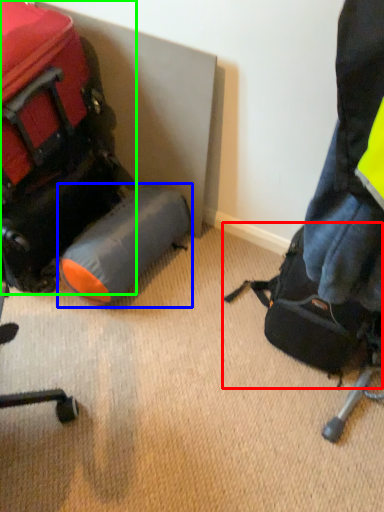
Question: Which object is positioned closest to luggage and bags (highlighted by a red box)? Select from luggage (highlighted by a blue box) and luggage and bags (highlighted by a green box).

Choices:
 (A) luggage
 (B) luggage and bags

Answer: (A)